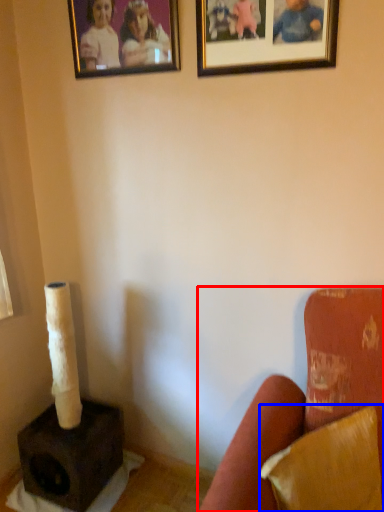
Question: Among these objects, which one is nearest to the camera, furniture (highlighted by a red box) or pillow (highlighted by a blue box)?

Choices:
 (A) furniture
 (B) pillow

Answer: (A)